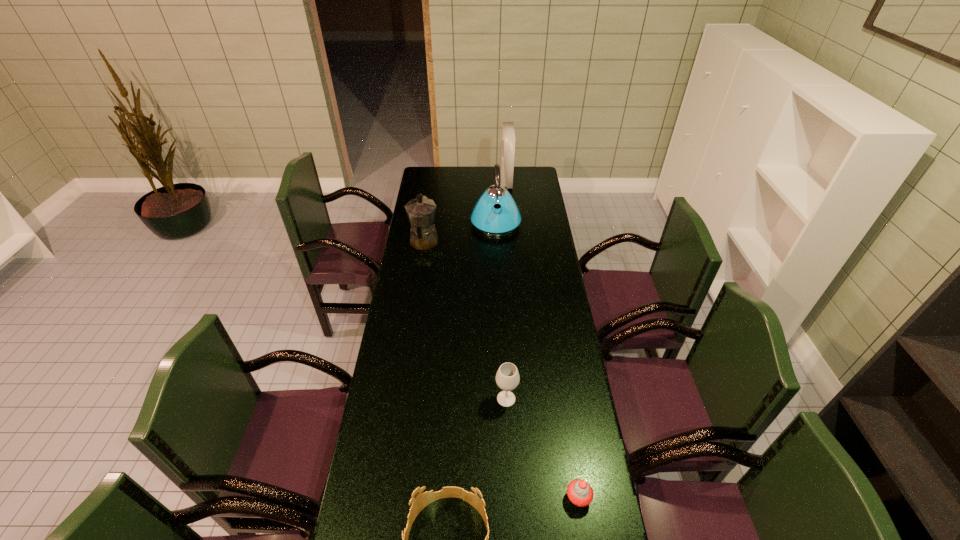
This screenshot has width=960, height=540. I want to click on free spot that satisfies the following two spatial constraints: 1. at the spout of the kettle; 2. on the right side of the wineglass, so click(x=504, y=399).

I want to click on vacant space that satisfies the following two spatial constraints: 1. on the front-facing side of the shortest object; 2. on the left side of the farthest object, so [532, 498].

The height and width of the screenshot is (540, 960). Identify the location of free space that satisfies the following two spatial constraints: 1. on the front-facing side of the farthest object; 2. at the spout of the kettle. (509, 222).